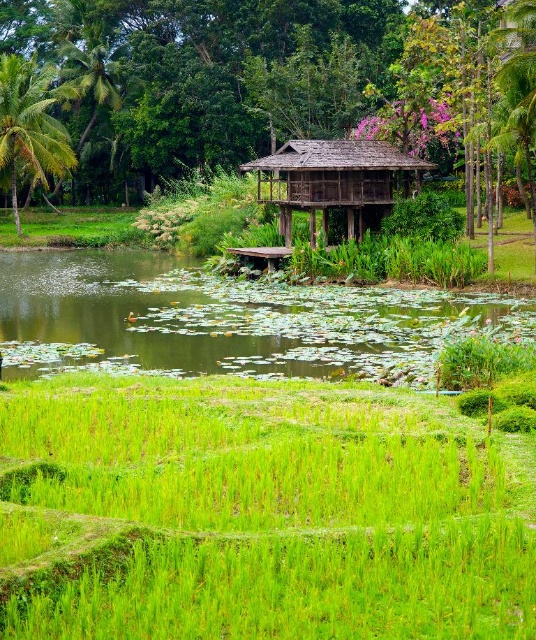
Is green lily pads at center bigger than green leafy palm tree at upper left?

Yes.

Identify the location of green lily pads at center. (221, 320).

Is green grassy rice field at center wider than brown wooden hut at center?

Incorrect, green grassy rice field at center's width does not surpass brown wooden hut at center's.

In the scene shown: Can you confirm if green grassy rice field at center is taller than brown wooden hut at center?

In fact, green grassy rice field at center may be shorter than brown wooden hut at center.

Which is behind, point (423, 397) or point (354, 44)?

Point (354, 44)

Where is `green grassy rice field at center`? Image resolution: width=536 pixels, height=640 pixels. green grassy rice field at center is located at coordinates (257, 513).

Is green grassy rice field at center in front of green leafy palm tree at upper left?

Yes, it is.

Between point (494, 637) and point (77, 61), which one is positioned behind?

Positioned behind is point (77, 61).

Is point (394, 408) positioned after point (95, 113)?

No, (394, 408) is closer to viewer.

At what (x,y) coordinates should I click in order to perform the action: click on green grassy rice field at center. Please return your answer as a coordinate pair (x, y). The width and height of the screenshot is (536, 640). Looking at the image, I should click on (257, 513).